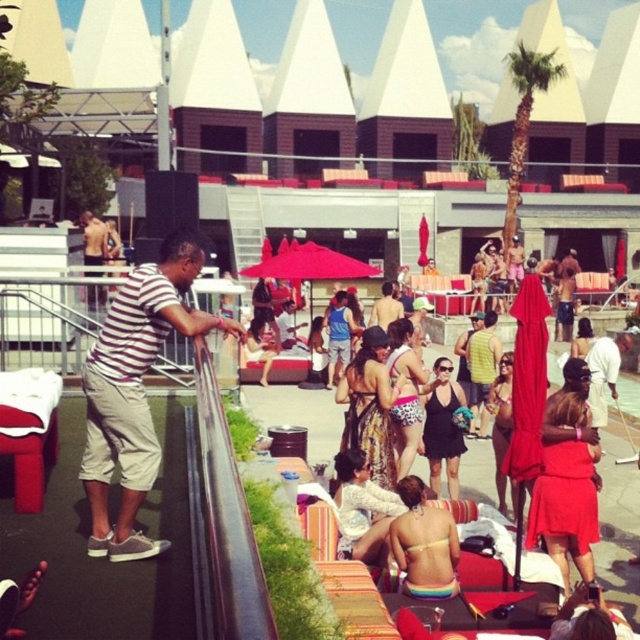
Question: Does striped cotton shirt at left come in front of rainbow bikini at center?

Choices:
 (A) yes
 (B) no

Answer: (A)

Question: Is striped cotton shirt at left above striped cotton shirt at center?

Choices:
 (A) yes
 (B) no

Answer: (B)

Question: Can you confirm if rainbow bikini at center is smaller than striped cotton shirt at center?

Choices:
 (A) no
 (B) yes

Answer: (B)

Question: Which object is closer to the camera taking this photo?

Choices:
 (A) striped cotton shirt at center
 (B) rainbow bikini at center
 (C) striped cotton shirt at left
 (D) green leafy palm tree at upper right

Answer: (C)

Question: Based on their relative distances, which object is farther from the green leafy palm tree at upper right?

Choices:
 (A) rainbow bikini at center
 (B) striped cotton shirt at center
 (C) striped cotton shirt at left

Answer: (C)

Question: Which of the following is the closest to the observer?

Choices:
 (A) striped cotton shirt at left
 (B) rainbow bikini at center

Answer: (A)